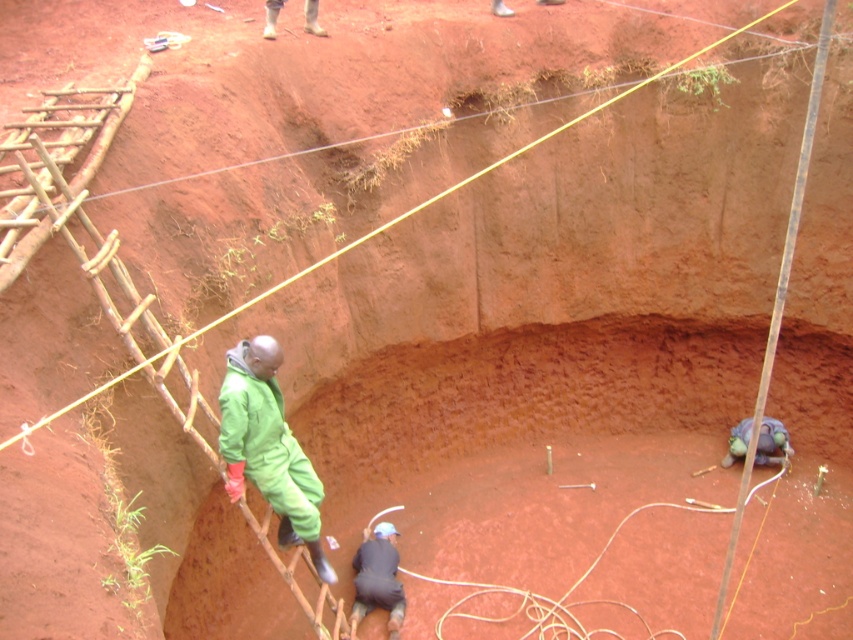
Question: Among these objects, which one is farthest from the camera?

Choices:
 (A) green matte jumpsuit at center
 (B) brown leather boots at upper center

Answer: (B)

Question: Considering the relative positions of green matte jumpsuit at center and dark blue fabric at lower center in the image provided, where is green matte jumpsuit at center located with respect to dark blue fabric at lower center?

Choices:
 (A) below
 (B) above

Answer: (B)

Question: Which object is closer to the camera taking this photo?

Choices:
 (A) dark blue fabric at lower center
 (B) brown leather boots at upper center
 (C) purple fabric at lower right

Answer: (A)

Question: Considering the relative positions of purple fabric at lower right and brown leather boots at upper center in the image provided, where is purple fabric at lower right located with respect to brown leather boots at upper center?

Choices:
 (A) above
 (B) below

Answer: (B)

Question: Which of the following is the closest to the observer?

Choices:
 (A) (360, 596)
 (B) (265, 16)
 (C) (305, 468)

Answer: (C)

Question: In this image, where is dark blue fabric at lower center located relative to brown leather boots at upper center?

Choices:
 (A) left
 (B) right

Answer: (B)